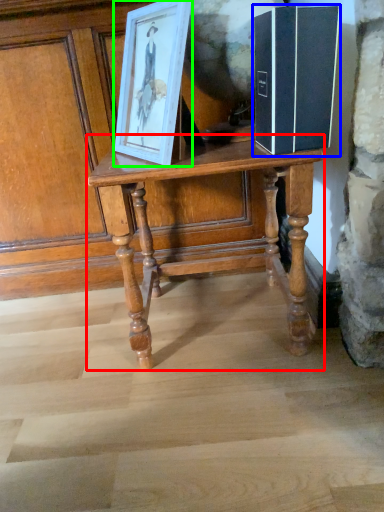
Question: Considering the real-world distances, which object is closest to table (highlighted by a red box)? book (highlighted by a blue box) or picture frame (highlighted by a green box).

Choices:
 (A) book
 (B) picture frame

Answer: (B)